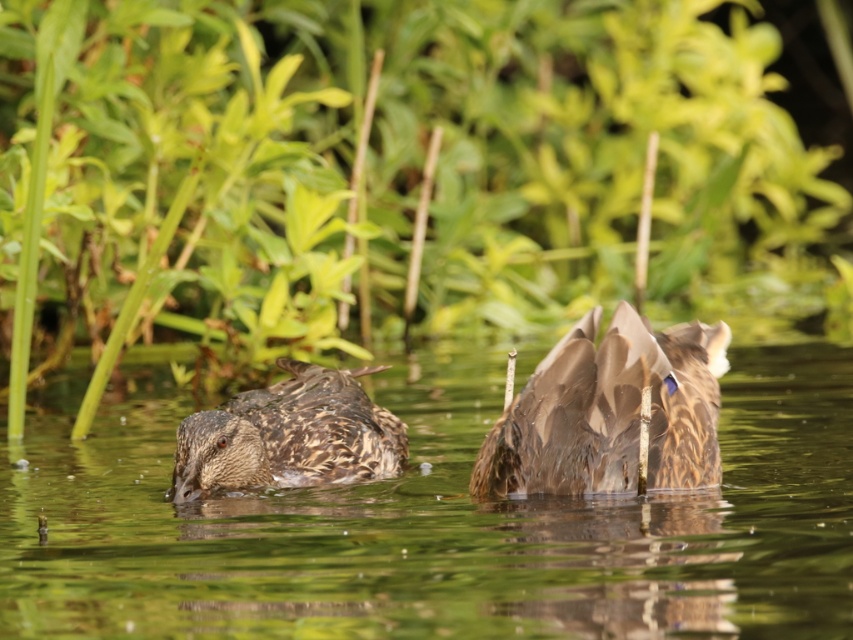
You are a photographer aiming to capture a clear photo of the brown feathered duck at center without the green leafy plant at center blocking the view. Based on their heights, can you position yourself in a way to avoid the plant obscuring the duck?

The green leafy plant at center is taller than the brown feathered duck at center, so positioning yourself lower or moving to a side angle might help avoid the plant blocking the duck.

You are standing at the edge of a pond and see two points marked in the water. The first point is at coordinates point (143, 394) and the second is at point (541, 422). Which point is closer to you?

Point (143, 394) is closer to you because it is further to the viewer than point (541, 422).